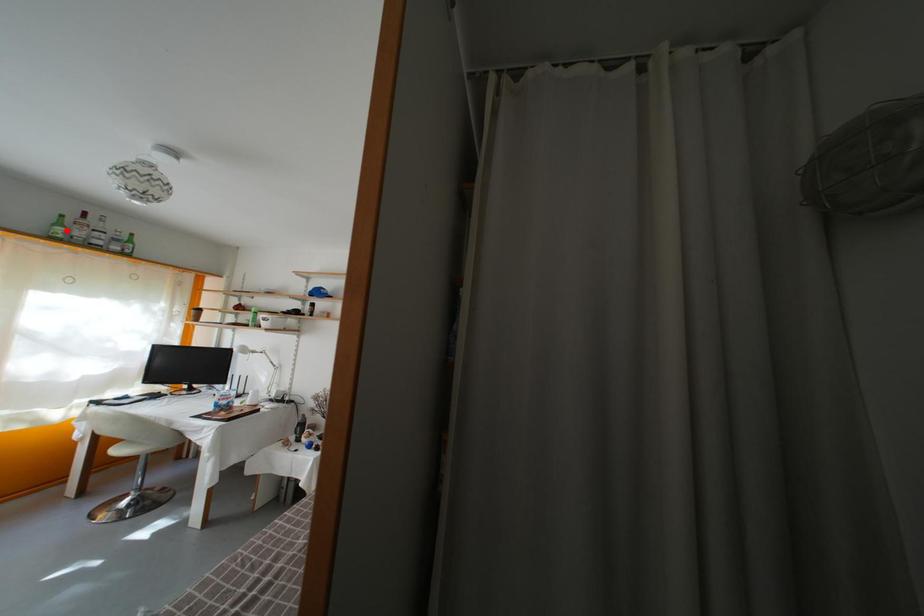
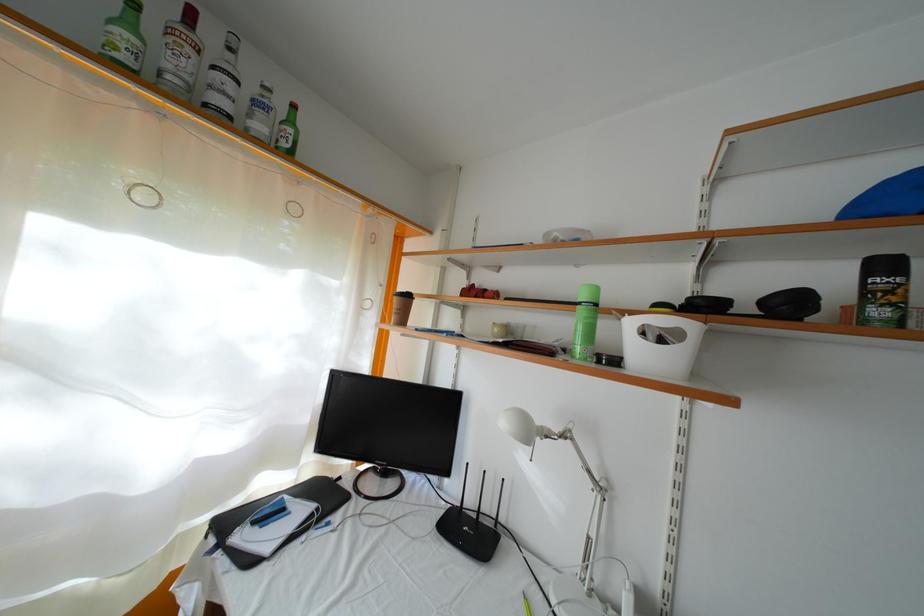
In the second image, find the point that corresponds to the highlighted location in the first image.

(134, 31)